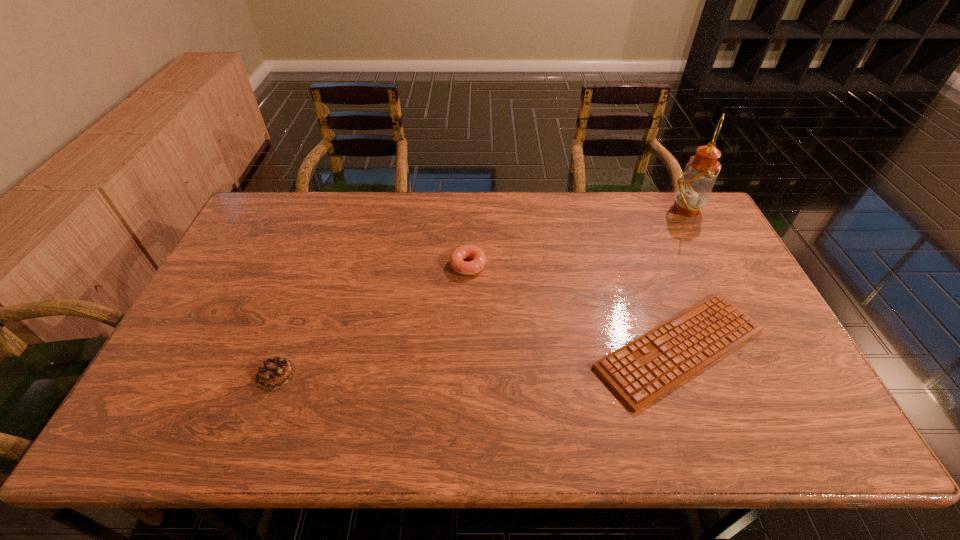
Identify the location of free space between the leftmost object and the second object from left to right. (372, 320).

The width and height of the screenshot is (960, 540). In order to click on unoccupied position between the doughnut and the leftmost object in this screenshot , I will do `click(372, 320)`.

Locate which object ranks third in proximity to the third nearest object. Please provide its 2D coordinates. Your answer should be formatted as a tuple, i.e. [(x, y)], where the tuple contains the x and y coordinates of a point satisfying the conditions above.

[(694, 187)]

Where is `object that stands as the third closest to the shortest object`? Image resolution: width=960 pixels, height=540 pixels. object that stands as the third closest to the shortest object is located at coordinates (274, 373).

Identify the location of vacant space that satisfies the following two spatial constraints: 1. on the back side of the leftmost object; 2. on the right side of the computer keyboard. click(286, 348).

Find the location of a particular element. This screenshot has width=960, height=540. vacant space that satisfies the following two spatial constraints: 1. on the back side of the oil lamp; 2. on the right side of the shortest object is located at coordinates (627, 209).